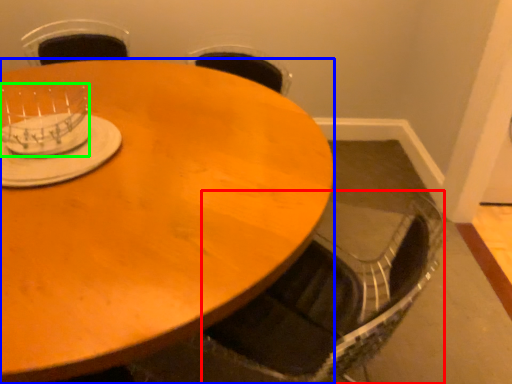
Question: Which object is positioned closest to swivel chair (highlighted by a red box)? Select from coffee table (highlighted by a blue box) and tableware (highlighted by a green box).

Choices:
 (A) coffee table
 (B) tableware

Answer: (A)